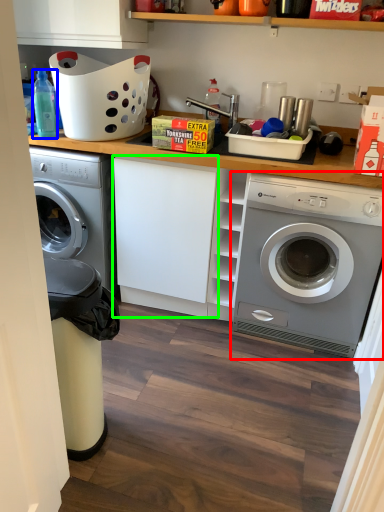
Question: Which is farther away from washing machine (highlighted by a red box)? bottle (highlighted by a blue box) or cabinetry (highlighted by a green box)?

Choices:
 (A) bottle
 (B) cabinetry

Answer: (A)